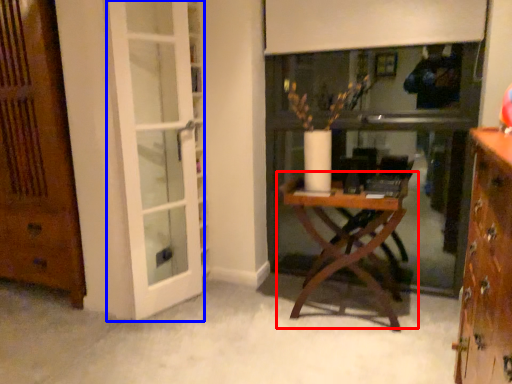
Question: Which object appears farthest to the camera in this image, table (highlighted by a red box) or screen door (highlighted by a blue box)?

Choices:
 (A) table
 (B) screen door

Answer: (A)